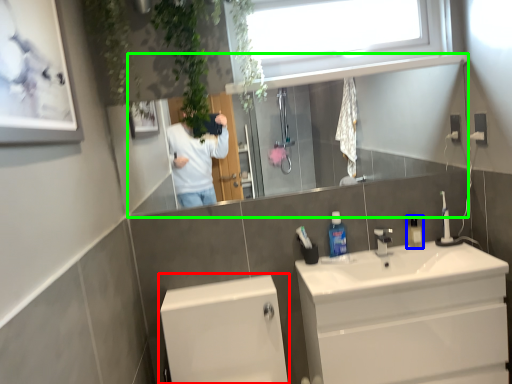
Question: Which object is positioned closest to bath (highlighted by a red box)? Select from mouthwash (highlighted by a blue box) and mirror (highlighted by a green box).

Choices:
 (A) mouthwash
 (B) mirror

Answer: (B)